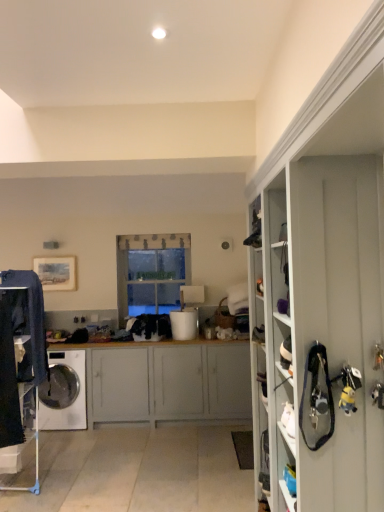
Question: Is white matte cabinet at center to the right of clear glass window at center from the viewer's perspective?

Choices:
 (A) no
 (B) yes

Answer: (A)

Question: Can you confirm if white matte cabinet at center is wider than clear glass window at center?

Choices:
 (A) no
 (B) yes

Answer: (B)

Question: Is white matte cabinet at center behind clear glass window at center?

Choices:
 (A) no
 (B) yes

Answer: (A)

Question: Is clear glass window at center inside white matte cabinet at center?

Choices:
 (A) no
 (B) yes

Answer: (A)

Question: Would you consider white matte cabinet at center to be distant from clear glass window at center?

Choices:
 (A) yes
 (B) no

Answer: (A)

Question: From a real-world perspective, is white matte cabinet at center below clear glass window at center?

Choices:
 (A) no
 (B) yes

Answer: (B)

Question: Does white matte cabinet at center have a greater width compared to dark blue denim jeans at left?

Choices:
 (A) no
 (B) yes

Answer: (B)

Question: Is white matte cabinet at center positioned before dark blue denim jeans at left?

Choices:
 (A) no
 (B) yes

Answer: (A)

Question: Considering the relative sizes of white matte cabinet at center and dark blue denim jeans at left in the image provided, is white matte cabinet at center taller than dark blue denim jeans at left?

Choices:
 (A) yes
 (B) no

Answer: (B)

Question: Is white matte cabinet at center positioned with its back to dark blue denim jeans at left?

Choices:
 (A) no
 (B) yes

Answer: (A)

Question: Does white matte cabinet at center have a larger size compared to dark blue denim jeans at left?

Choices:
 (A) yes
 (B) no

Answer: (A)

Question: Does white matte cabinet at center have a smaller size compared to dark blue denim jeans at left?

Choices:
 (A) yes
 (B) no

Answer: (B)

Question: From a real-world perspective, is clear glass window at center on white matte cabinet at center?

Choices:
 (A) yes
 (B) no

Answer: (A)